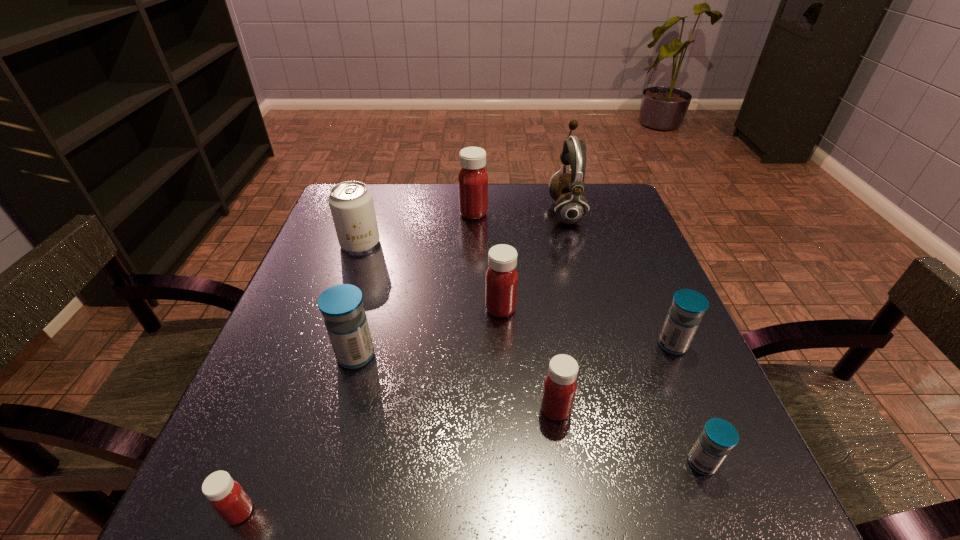
The height and width of the screenshot is (540, 960). Find the location of `object that stands as the fifth closest to the leftmost blue medicine`. object that stands as the fifth closest to the leftmost blue medicine is located at coordinates (x=472, y=180).

I want to click on medicine that is the third closest to the farthest medicine, so click(x=688, y=306).

Locate an element on the screen. The image size is (960, 540). medicine that stands as the third closest to the nearest blue medicine is located at coordinates (501, 277).

Select which red medicine appears as the third closest to the leftmost red medicine. Please provide its 2D coordinates. Your answer should be formatted as a tuple, i.e. [(x, y)], where the tuple contains the x and y coordinates of a point satisfying the conditions above.

[(472, 180)]

Where is `red medicine that stands as the fourth closest to the nearest blue medicine`? This screenshot has height=540, width=960. red medicine that stands as the fourth closest to the nearest blue medicine is located at coordinates (472, 180).

Identify which blue medicine is the second closest to the soda can. Please provide its 2D coordinates. Your answer should be formatted as a tuple, i.e. [(x, y)], where the tuple contains the x and y coordinates of a point satisfying the conditions above.

[(688, 306)]

Find the location of a particular element. the closest blue medicine relative to the tallest medicine is located at coordinates (341, 305).

Identify the location of vacant region that satisfies the following two spatial constraints: 1. on the ear pads of the brown earphone; 2. on the left side of the second smallest blue medicine. point(602,345).

You are a GUI agent. You are given a task and a screenshot of the screen. Output one action in this format:
    pyautogui.click(x=<x>, y=<y>)
    Task: Click on the free space that satisfies the following two spatial constraints: 1. on the back side of the smallest blue medicine; 2. on the ear pads of the earphone
    The width and height of the screenshot is (960, 540).
    Given the screenshot: What is the action you would take?
    pyautogui.click(x=604, y=211)

The width and height of the screenshot is (960, 540). Identify the location of vacant space that satisfies the following two spatial constraints: 1. on the ear pads of the second biggest blue medicine; 2. on the right side of the earphone. (602, 345).